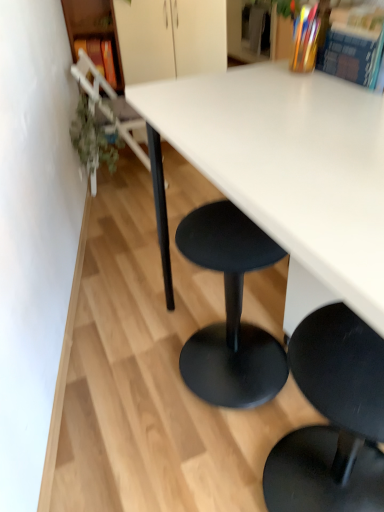
Question: Can you confirm if green leafy plant at left is taller than white matte table at center?

Choices:
 (A) no
 (B) yes

Answer: (A)

Question: From a real-world perspective, is green leafy plant at left positioned under white matte table at center based on gravity?

Choices:
 (A) yes
 (B) no

Answer: (A)

Question: Is green leafy plant at left closer to camera compared to white matte table at center?

Choices:
 (A) no
 (B) yes

Answer: (A)

Question: Can you confirm if green leafy plant at left is wider than white matte table at center?

Choices:
 (A) no
 (B) yes

Answer: (A)

Question: Can you see green leafy plant at left touching white matte table at center?

Choices:
 (A) no
 (B) yes

Answer: (A)

Question: In the image, is wooden bookshelf at left on the left side or the right side of matte orange book at upper left, marked as the 3th book in a bottom-to-top arrangement?

Choices:
 (A) left
 (B) right

Answer: (B)

Question: Is point tap(109, 23) closer or farther from the camera than point tap(112, 75)?

Choices:
 (A) farther
 (B) closer

Answer: (B)

Question: Is wooden bookshelf at left wider or thinner than matte orange book at upper left, which appears as the 1th book when viewed from the back?

Choices:
 (A) wide
 (B) thin

Answer: (A)

Question: Considering the positions of wooden bookshelf at left and matte orange book at upper left, which appears as the 1th book when viewed from the back, in the image, is wooden bookshelf at left bigger or smaller than matte orange book at upper left, which appears as the 1th book when viewed from the back,?

Choices:
 (A) big
 (B) small

Answer: (A)

Question: Is matte orange book at upper left, which appears as the 1th book when viewed from the back, wider or thinner than white matte table at center?

Choices:
 (A) wide
 (B) thin

Answer: (B)

Question: Considering the relative positions of matte orange book at upper left, the first book from the top, and white matte table at center in the image provided, is matte orange book at upper left, the first book from the top, to the left or to the right of white matte table at center?

Choices:
 (A) right
 (B) left

Answer: (B)

Question: Looking at the image, does matte orange book at upper left, the 1th book in the left-to-right sequence, seem bigger or smaller compared to white matte table at center?

Choices:
 (A) big
 (B) small

Answer: (B)

Question: Considering the positions of point (109, 60) and point (324, 121), is point (109, 60) closer or farther from the camera than point (324, 121)?

Choices:
 (A) farther
 (B) closer

Answer: (A)

Question: From the image's perspective, is wooden bookshelf at left positioned above or below metallic silver chair at left, the first chair positioned from the top?

Choices:
 (A) above
 (B) below

Answer: (A)

Question: In terms of height, does wooden bookshelf at left look taller or shorter compared to metallic silver chair at left, acting as the second chair starting from the front?

Choices:
 (A) tall
 (B) short

Answer: (A)